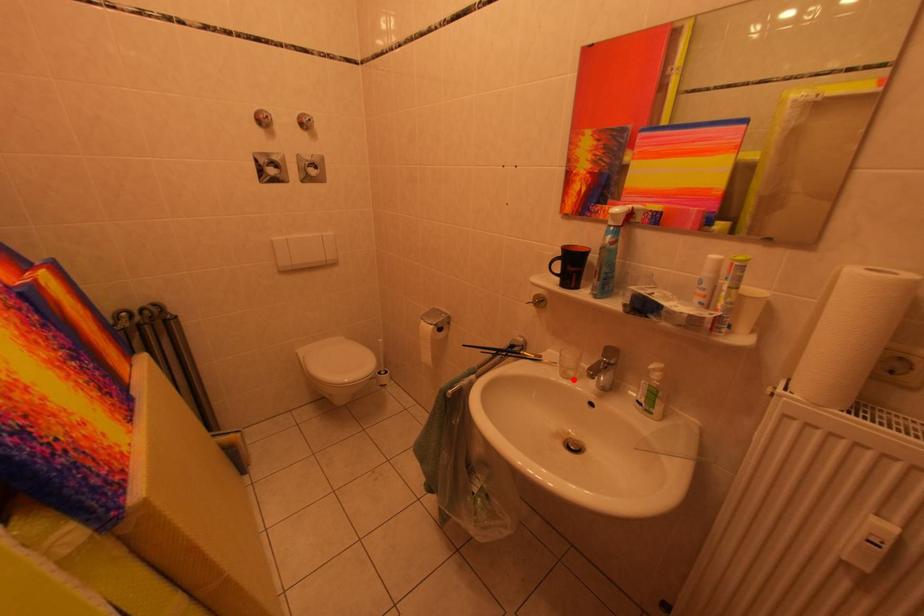
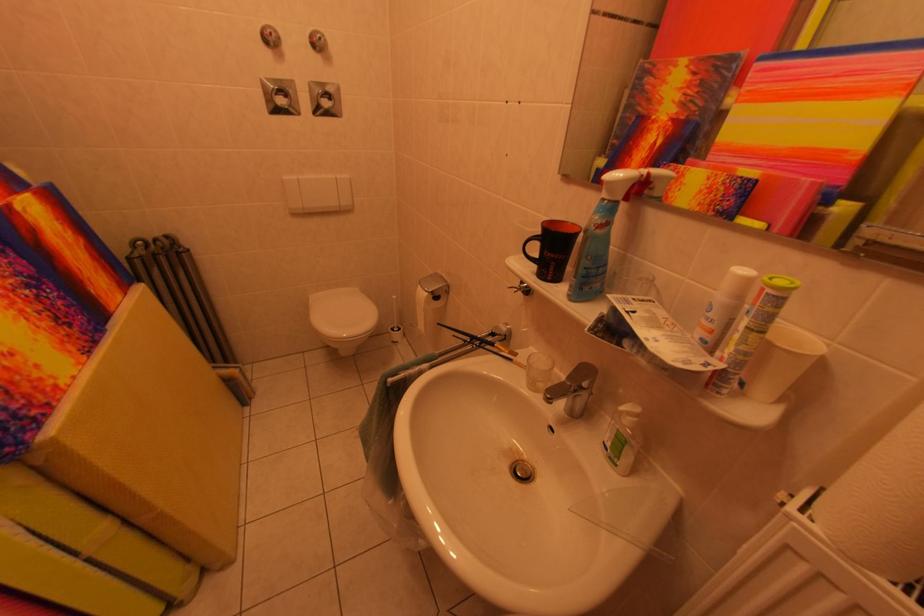
Locate, in the second image, the point that corresponds to the highlighted location in the first image.

(541, 389)